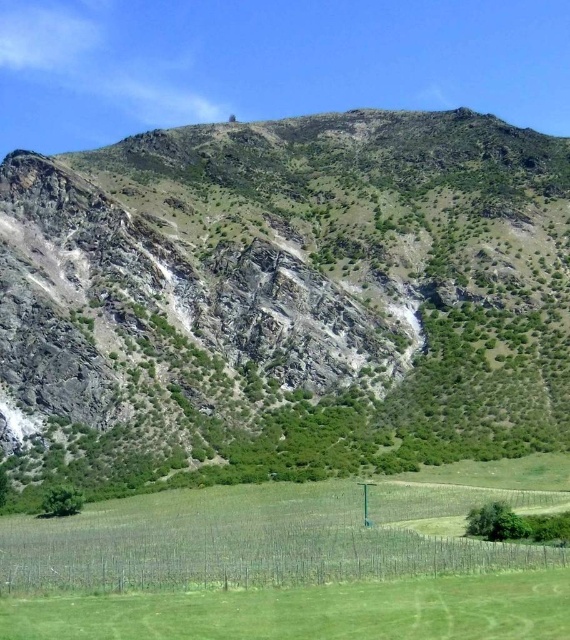
You are standing in the vineyard field and want to reach the base of the mountain. Which point, point (231,285) or point (563,573), is closer to you?

Point (231,285) is closer to you since it is further to the viewer than point (563,573), meaning it requires less distance to reach.

You are a hiker planning to climb the green rocky mountain at upper center and then descend to the green grassy field at lower center. Which part of the journey will require more physical effort?

Climbing the green rocky mountain at upper center will require more physical effort because it is taller than the green grassy field at lower center, making the ascent more challenging.

You are a hiker planning to walk from the green grassy field at lower center to the green rocky mountain at upper center. Given that your average walking pace is 1.4 meters per second, how many minutes will it take you to reach the mountain?

The distance between the green rocky mountain at upper center and the green grassy field at lower center is 44.56 meters. At a pace of 1.4 meters per second, it would take approximately 31.83 seconds, which is about 0.53 minutes. Therefore, it will take roughly half a minute to reach the mountain.